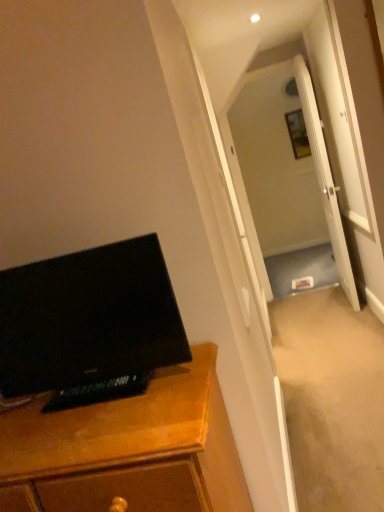
Question: Considering the positions of black glossy monitor at left and wooden cabinet at left in the image, is black glossy monitor at left bigger or smaller than wooden cabinet at left?

Choices:
 (A) big
 (B) small

Answer: (B)

Question: Is black glossy monitor at left to the left or to the right of wooden cabinet at left in the image?

Choices:
 (A) right
 (B) left

Answer: (B)

Question: Estimate the real-world distances between objects in this image. Which object is farther from the wooden cabinet at left?

Choices:
 (A) black glossy monitor at left
 (B) wooden picture frame at upper center
 (C) white glossy door at center
 (D) transparent glass door at center

Answer: (B)

Question: Which object is the closest to the white glossy door at center?

Choices:
 (A) black glossy monitor at left
 (B) transparent glass door at center
 (C) wooden picture frame at upper center
 (D) wooden cabinet at left

Answer: (B)